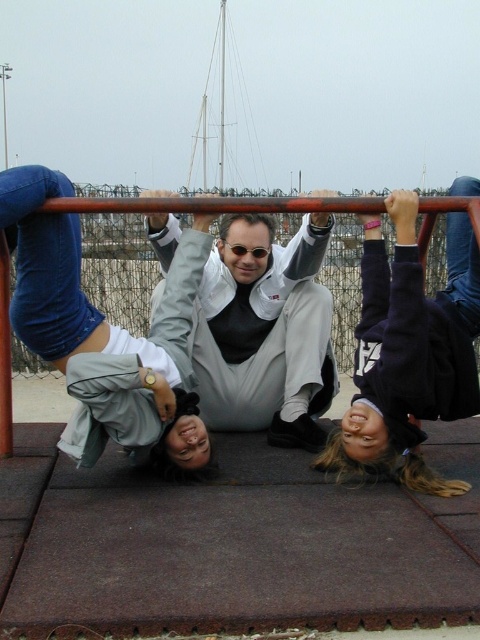
You are a photographer trying to capture a candid shot of the two people hanging upside down on the horizontal bar. You want to ensure both the dark blue sweater at center and the white matte jacket at center are clearly visible in the frame. Based on their positions, which one is lower in the image?

The dark blue sweater at center is located below the white matte jacket at center, so the dark blue sweater at center appears lower in the image.

Looking at this image, you are a photographer trying to capture a photo of the dark blue sweater at center and the white matte jacket at center while they are hanging upside down from the horizontal bar. Since you want to ensure both subjects are fully visible in the frame, which subject should you position closer to the camera to avoid cropping?

The dark blue sweater at center is much taller than the white matte jacket at center. To ensure both are fully visible, position the taller dark blue sweater at center closer to the camera so its height doesn